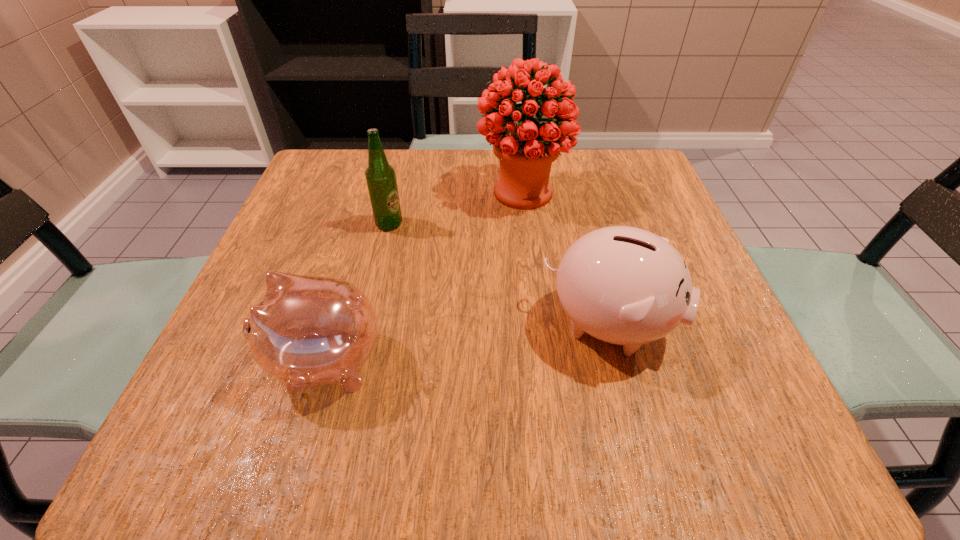
Locate an element on the screen. bouquet is located at coordinates (526, 151).

Where is `beer bottle`? Image resolution: width=960 pixels, height=540 pixels. beer bottle is located at coordinates (381, 179).

The width and height of the screenshot is (960, 540). I want to click on the right piggy bank, so click(623, 285).

Where is `the left piggy bank`? The image size is (960, 540). the left piggy bank is located at coordinates (307, 331).

The height and width of the screenshot is (540, 960). Identify the location of vacant space located on the front of the tallest object. (530, 251).

Locate an element on the screen. vacant space positioned on the label of the beer bottle is located at coordinates (486, 224).

In order to click on vacant space positioned 0.050m on the left of the right piggy bank in this screenshot , I will do `click(511, 324)`.

Find the location of a particular element. vacant space situated 0.080m on the front facing side of the left piggy bank is located at coordinates (213, 362).

The width and height of the screenshot is (960, 540). I want to click on object at the far edge, so click(526, 151).

The height and width of the screenshot is (540, 960). I want to click on object positioned at the near edge, so click(307, 331).